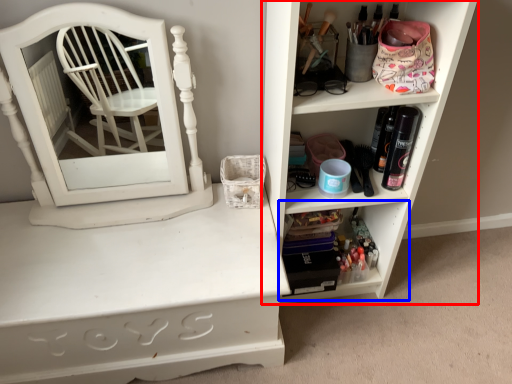
Question: Which object is further to the camera taking this photo, shelf (highlighted by a red box) or shelf (highlighted by a blue box)?

Choices:
 (A) shelf
 (B) shelf

Answer: (B)